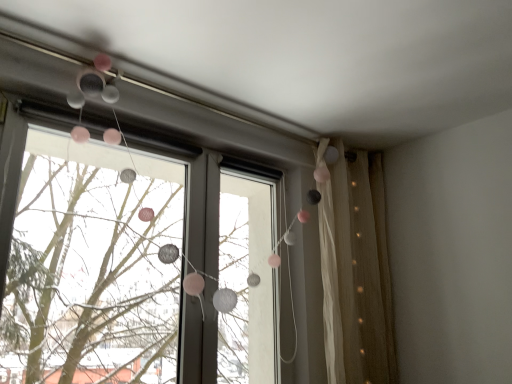
Question: In the image, is matte silver garland at upper center positioned in front of or behind beige sheer curtain at right?

Choices:
 (A) front
 (B) behind

Answer: (A)

Question: Is matte silver garland at upper center inside or outside of beige sheer curtain at right?

Choices:
 (A) inside
 (B) outside

Answer: (B)

Question: Is matte silver garland at upper center wider or thinner than beige sheer curtain at right?

Choices:
 (A) wide
 (B) thin

Answer: (B)

Question: Is point (349, 192) positioned closer to the camera than point (344, 269)?

Choices:
 (A) closer
 (B) farther

Answer: (B)

Question: In the image, is beige sheer curtain at right positioned in front of or behind matte silver garland at upper center?

Choices:
 (A) front
 (B) behind

Answer: (B)

Question: Is beige sheer curtain at right situated inside matte silver garland at upper center or outside?

Choices:
 (A) outside
 (B) inside

Answer: (A)

Question: From a real-world perspective, is beige sheer curtain at right physically located above or below matte silver garland at upper center?

Choices:
 (A) above
 (B) below

Answer: (B)